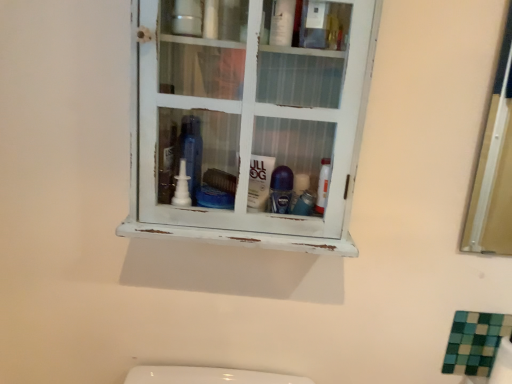
The height and width of the screenshot is (384, 512). What are the coordinates of `white distressed wood cabinet at center` in the screenshot? It's located at (249, 118).

The width and height of the screenshot is (512, 384). Describe the element at coordinates (249, 118) in the screenshot. I see `white distressed wood cabinet at center` at that location.

This screenshot has height=384, width=512. What are the coordinates of `white distressed wood cabinet at center` in the screenshot? It's located at (249, 118).